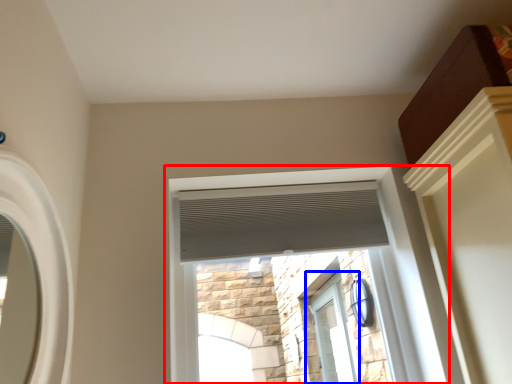
Question: Which point is further to the camera, window (highlighted by a red box) or window (highlighted by a blue box)?

Choices:
 (A) window
 (B) window

Answer: (B)